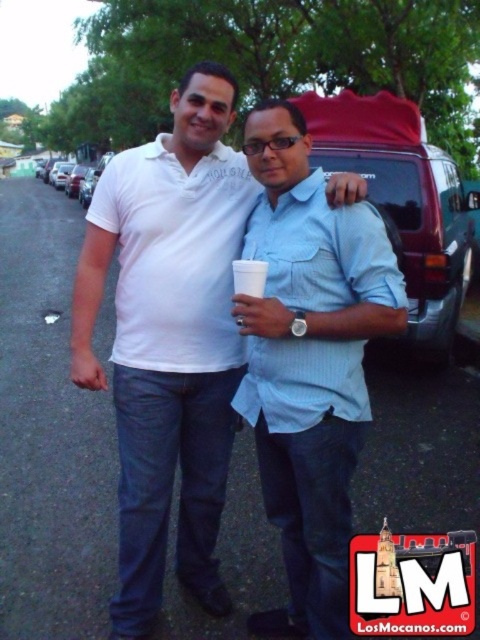
Question: Which point is closer to the camera?

Choices:
 (A) white cotton polo shirt at center
 (B) blue striped shirt at center
 (C) light blue cotton shirt at center

Answer: (C)

Question: Which of these objects is positioned closest to the light blue cotton shirt at center?

Choices:
 (A) white cotton polo shirt at center
 (B) blue striped shirt at center

Answer: (B)

Question: Does white cotton polo shirt at center lie behind blue striped shirt at center?

Choices:
 (A) yes
 (B) no

Answer: (A)

Question: Considering the relative positions of blue striped shirt at center and light blue cotton shirt at center in the image provided, where is blue striped shirt at center located with respect to light blue cotton shirt at center?

Choices:
 (A) below
 (B) above

Answer: (A)

Question: Which point appears farthest from the camera in this image?

Choices:
 (A) (331, 435)
 (B) (309, 308)
 (C) (108, 227)

Answer: (C)

Question: Does white cotton polo shirt at center appear under blue striped shirt at center?

Choices:
 (A) yes
 (B) no

Answer: (B)